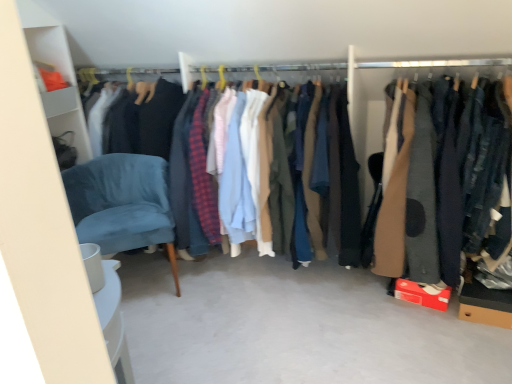
Question: Would you say matte cotton shirts at center, the 2th clothing viewed from the right, is a long distance from brown wool coat at right, arranged as the second clothing when viewed from the left?

Choices:
 (A) no
 (B) yes

Answer: (A)

Question: Is matte cotton shirts at center, the 2th clothing viewed from the right, completely or partially outside of brown wool coat at right, arranged as the second clothing when viewed from the left?

Choices:
 (A) no
 (B) yes

Answer: (B)

Question: From a real-world perspective, is matte cotton shirts at center, the 2th clothing viewed from the right, physically below brown wool coat at right, arranged as the second clothing when viewed from the left?

Choices:
 (A) yes
 (B) no

Answer: (A)

Question: Can you confirm if matte cotton shirts at center, which appears as the first clothing when viewed from the left, is positioned to the left of brown wool coat at right, arranged as the second clothing when viewed from the left?

Choices:
 (A) yes
 (B) no

Answer: (A)

Question: Is matte cotton shirts at center, the 2th clothing viewed from the right, next to brown wool coat at right, acting as the first clothing starting from the right?

Choices:
 (A) no
 (B) yes

Answer: (A)

Question: Is velvet blue chair at lower left to the left or to the right of brown wool coat at right, arranged as the second clothing when viewed from the left, in the image?

Choices:
 (A) left
 (B) right

Answer: (A)

Question: Considering the positions of point (108, 233) and point (450, 145), is point (108, 233) closer or farther from the camera than point (450, 145)?

Choices:
 (A) closer
 (B) farther

Answer: (B)

Question: From the image's perspective, is velvet blue chair at lower left above or below brown wool coat at right, arranged as the second clothing when viewed from the left?

Choices:
 (A) above
 (B) below

Answer: (B)

Question: Do you think velvet blue chair at lower left is within brown wool coat at right, arranged as the second clothing when viewed from the left, or outside of it?

Choices:
 (A) inside
 (B) outside

Answer: (B)

Question: Does point (429, 107) appear closer or farther from the camera than point (157, 218)?

Choices:
 (A) closer
 (B) farther

Answer: (A)

Question: Is brown wool coat at right, acting as the first clothing starting from the right, in front of or behind velvet blue chair at lower left in the image?

Choices:
 (A) front
 (B) behind

Answer: (A)

Question: Would you say brown wool coat at right, acting as the first clothing starting from the right, is to the left or to the right of velvet blue chair at lower left in the picture?

Choices:
 (A) right
 (B) left

Answer: (A)

Question: Is brown wool coat at right, acting as the first clothing starting from the right, wider or thinner than velvet blue chair at lower left?

Choices:
 (A) wide
 (B) thin

Answer: (A)

Question: Does point (162, 205) appear closer or farther from the camera than point (233, 236)?

Choices:
 (A) closer
 (B) farther

Answer: (A)

Question: In the image, is velvet blue chair at lower left on the left side or the right side of matte cotton shirts at center, the 2th clothing viewed from the right?

Choices:
 (A) left
 (B) right

Answer: (A)